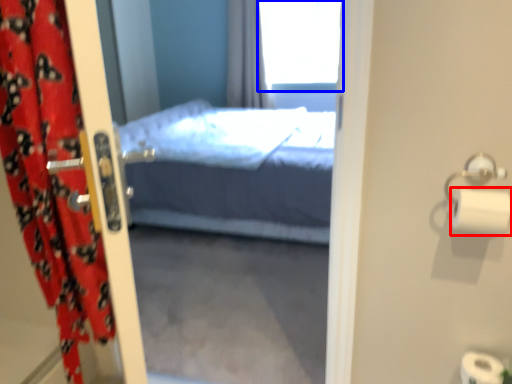
Question: Which of the following is the farthest to the observer, toilet paper (highlighted by a red box) or window (highlighted by a blue box)?

Choices:
 (A) toilet paper
 (B) window

Answer: (B)